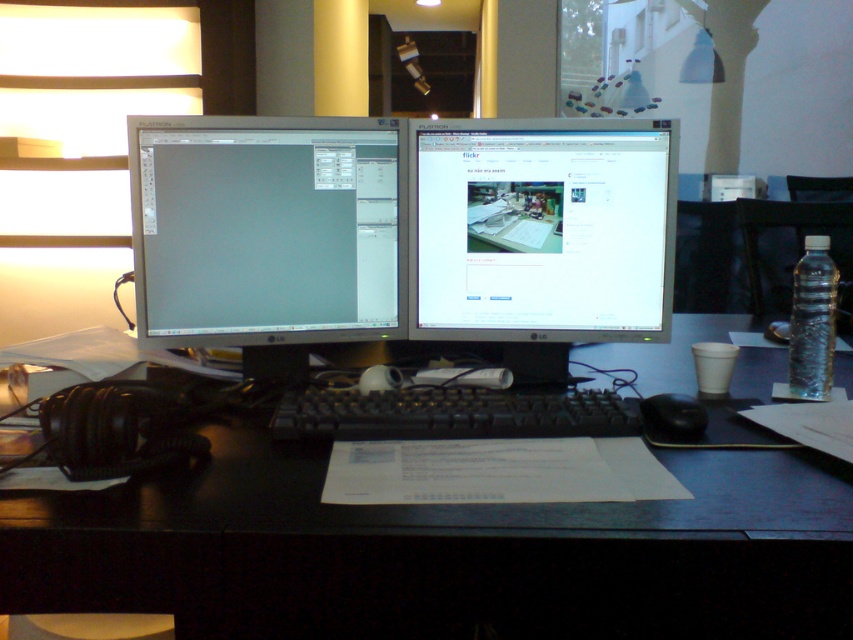
You are standing in front of a workspace with two monitors. There is a point at coordinates point (430,134). Can you reach that point without moving your body?

The point (430,134) is 1.28 meters away from you. Since the average arm length is about 0.7 meters, you cannot reach it without moving your body.

You are organizing your workspace and want to place a new wireless charger on the desk. The charger requires a clear space of 10 cm by 10 cm. Given the current setup, where can you place the charger without obstructing the black plastic computer desk at center or the black matte mouse at lower right?

The black plastic computer desk at center is positioned under the black matte mouse at lower right. Therefore, placing the wireless charger on the desk surface away from the area directly below the mouse and the desk itself would ensure it doesn

You are organizing your workspace and need to place a 12 inch long ruler between the black plastic computer desk at center and the black matte mouse at lower right. Will the ruler fit horizontally between them?

The black plastic computer desk at center and black matte mouse at lower right are 12.26 inches apart from each other, so a 12 inch ruler can fit horizontally between them since the distance is slightly larger than the ruler.